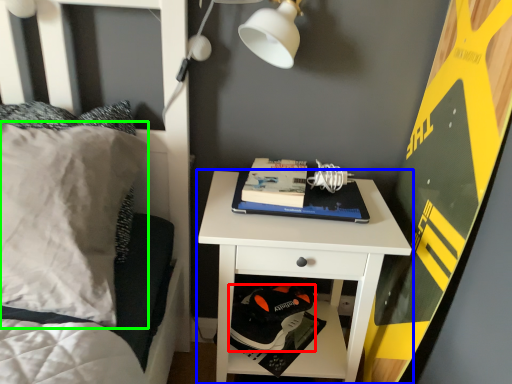
Question: Considering the real-world distances, which object is farthest from shoe (highlighted by a red box)? nightstand (highlighted by a blue box) or pillow (highlighted by a green box)?

Choices:
 (A) nightstand
 (B) pillow

Answer: (B)